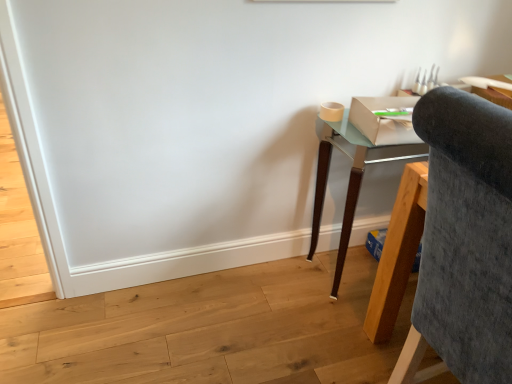
Image resolution: width=512 pixels, height=384 pixels. I want to click on free spot in front of teal glass desk at right, so click(344, 337).